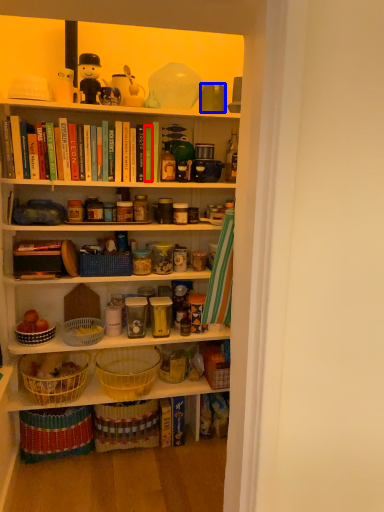
Question: Which point is further to the camera, book (highlighted by a red box) or coffee cup (highlighted by a blue box)?

Choices:
 (A) book
 (B) coffee cup

Answer: (A)